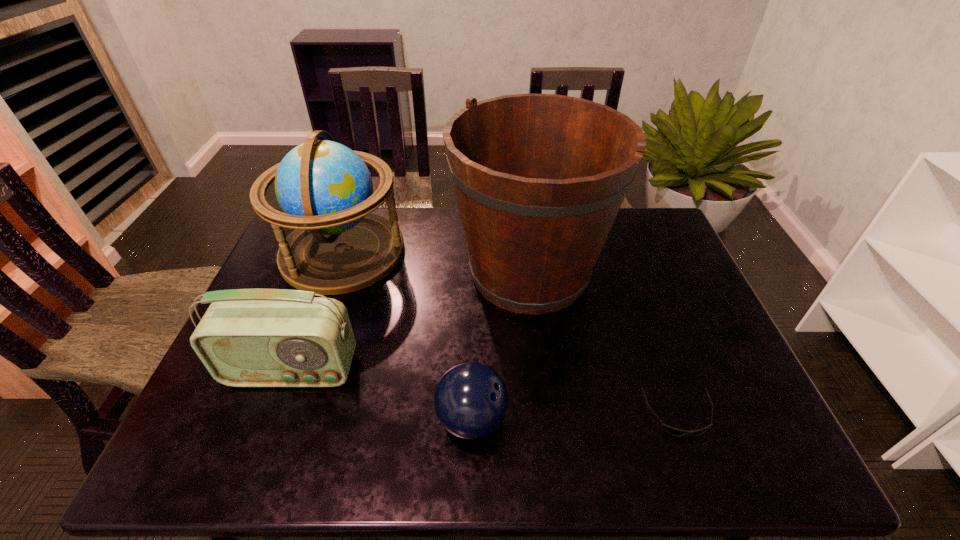
This screenshot has height=540, width=960. Identify the location of bucket that is at the far edge. (539, 179).

I want to click on globe that is at the far edge, so click(x=324, y=188).

The image size is (960, 540). Find the location of `bowling ball located at the near edge`. bowling ball located at the near edge is located at coordinates (471, 400).

You are a GUI agent. You are given a task and a screenshot of the screen. Output one action in this format:
    pyautogui.click(x=<x>, y=<y>)
    Task: Click on the sunglasses that is at the near edge
    This screenshot has width=960, height=540.
    Given the screenshot: What is the action you would take?
    pyautogui.click(x=674, y=431)

Where is `globe that is at the left edge`? Image resolution: width=960 pixels, height=540 pixels. globe that is at the left edge is located at coordinates (324, 188).

At what (x,y) coordinates should I click in order to perform the action: click on radio receiver that is at the left edge. Please return your answer as a coordinate pair (x, y). The width and height of the screenshot is (960, 540). Looking at the image, I should click on (247, 337).

Identify the location of object present at the right edge. The width and height of the screenshot is (960, 540). tap(674, 431).

Where is `object that is at the far left corner`? object that is at the far left corner is located at coordinates (324, 188).

The width and height of the screenshot is (960, 540). I want to click on object that is at the near right corner, so click(674, 431).

Locate an element on the screen. This screenshot has width=960, height=540. free space at the near edge of the desktop is located at coordinates [556, 440].